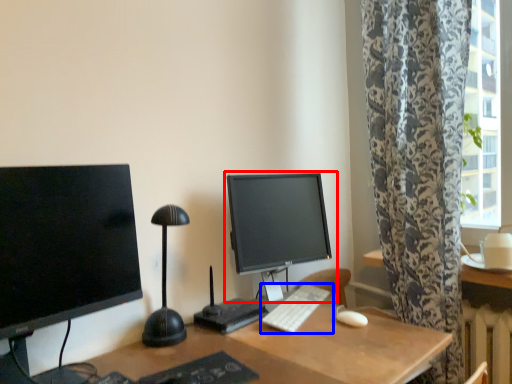
Question: Which of the following is the farthest to the observer, computer monitor (highlighted by a red box) or computer keyboard (highlighted by a blue box)?

Choices:
 (A) computer monitor
 (B) computer keyboard

Answer: (A)